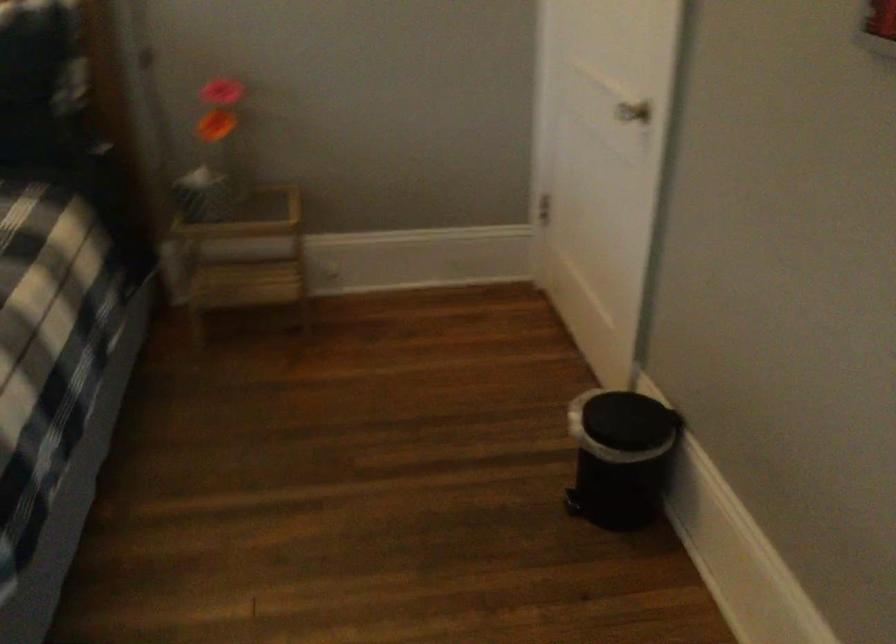
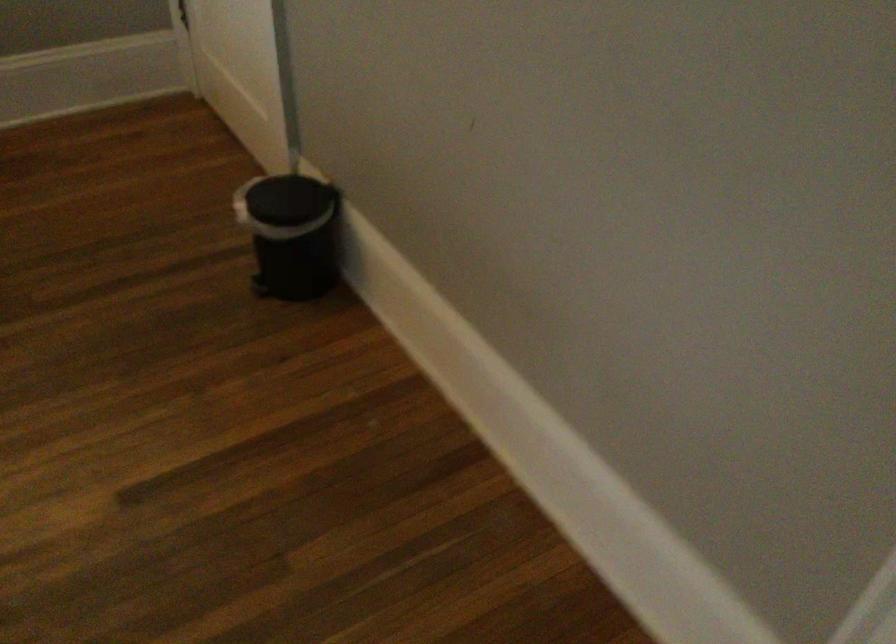
Question: The camera is either moving clockwise (left) or counter-clockwise (right) around the object. The first image is from the beginning of the video and the second image is from the end. Is the camera moving left or right when shooting the video?

Choices:
 (A) Left
 (B) Right

Answer: (A)